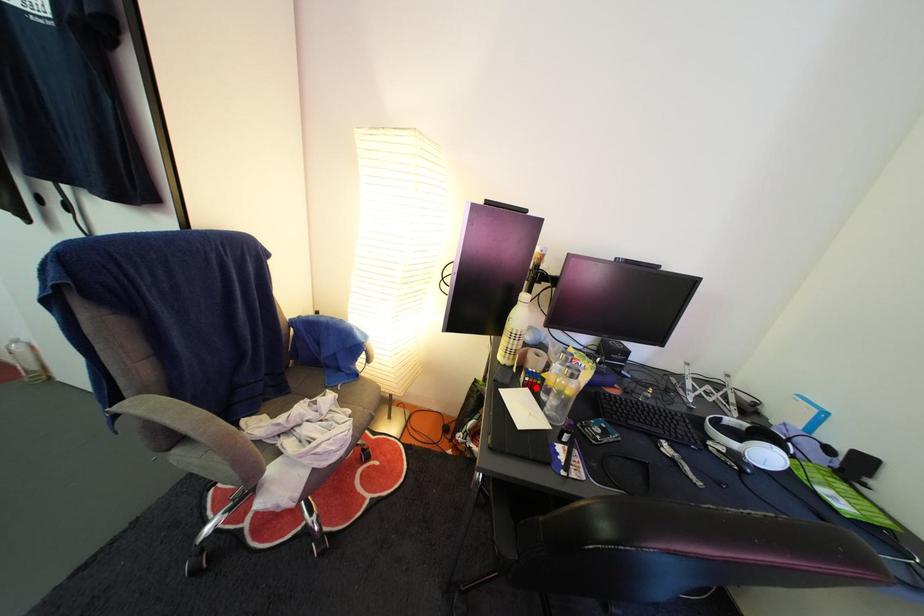
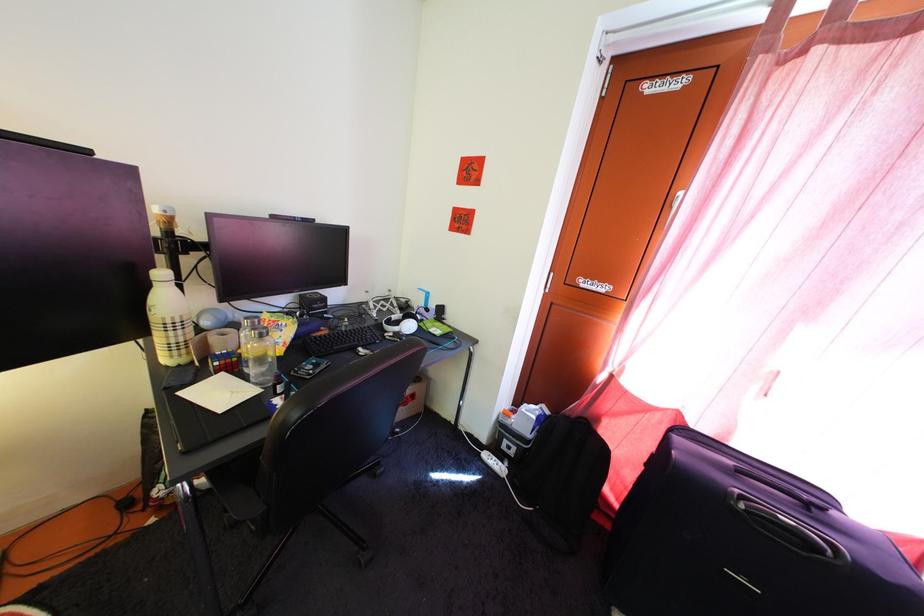
Where in the second image is the point corresponding to the highlighted location from the first image?

(225, 371)